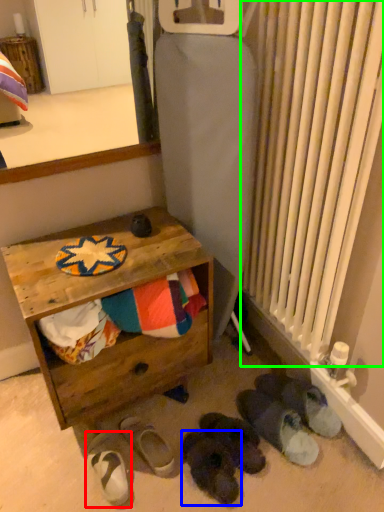
Question: Based on their relative distances, which object is nearer to footwear (highlighted by a red box)? Choose from footwear (highlighted by a blue box) and radiator (highlighted by a green box).

Choices:
 (A) footwear
 (B) radiator

Answer: (A)